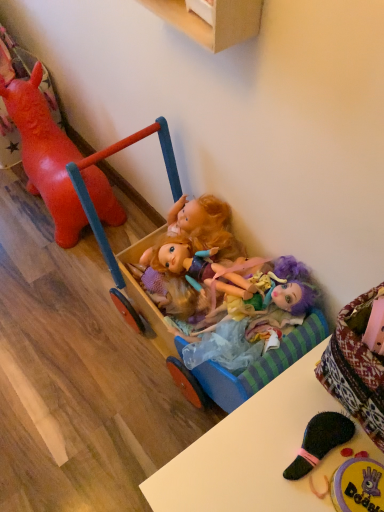
I want to click on free location in front of glossy plastic horse at left, the second toy in the front-to-back sequence, so click(x=43, y=281).